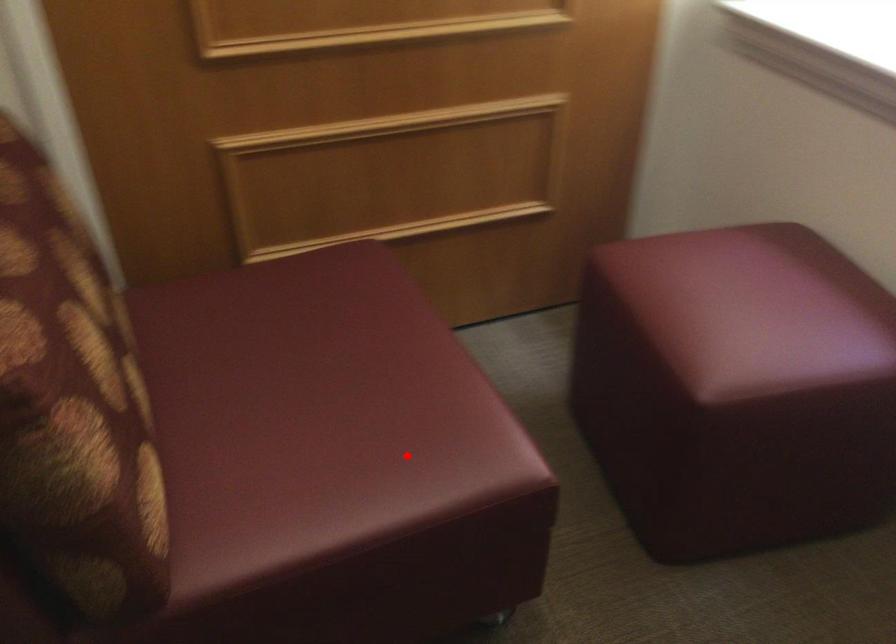
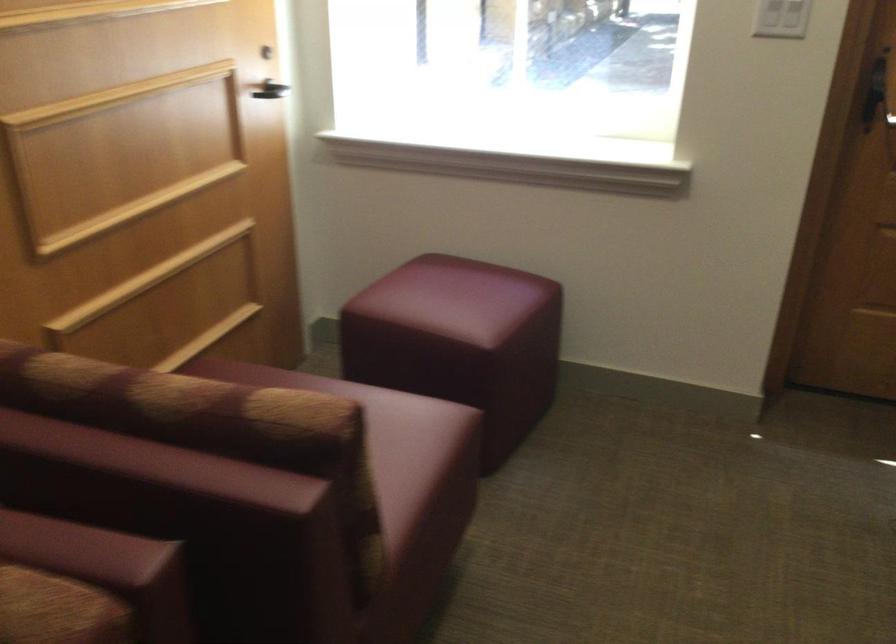
Question: I am providing you with two images of the same scene from different viewpoints. A red point is shown in image1. For the corresponding object point in image2, is it positioned nearer or farther from the camera?

Choices:
 (A) Nearer
 (B) Farther

Answer: (B)